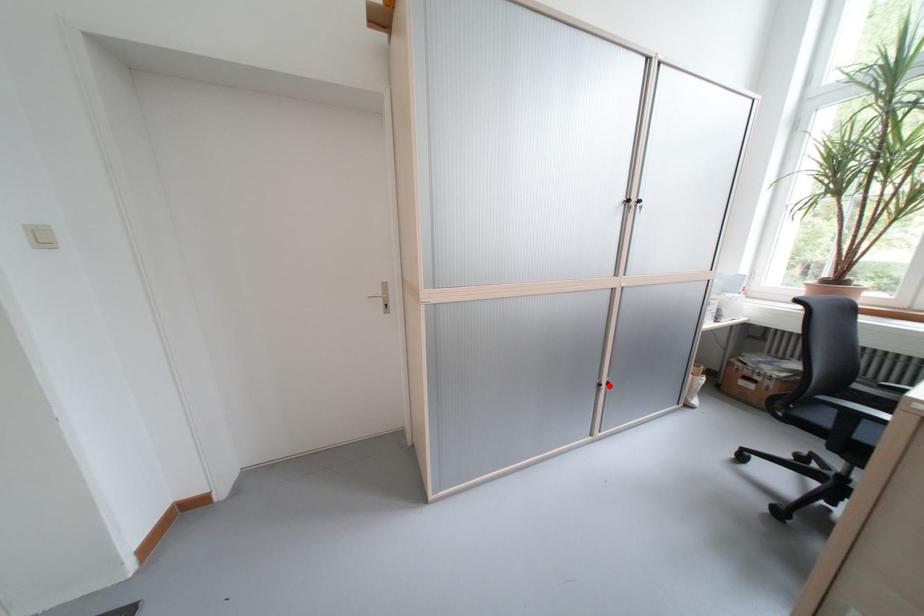
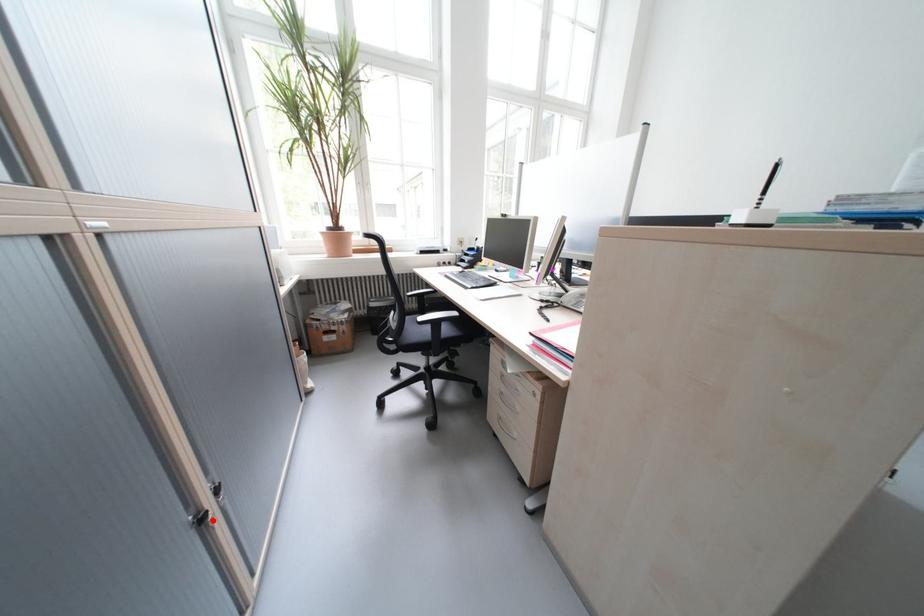
I am providing you with two images of the same scene from different viewpoints. A red point is marked on the first image and another point is marked on the second image. Is the red point in image1 aligned with the point shown in image2?

Yes